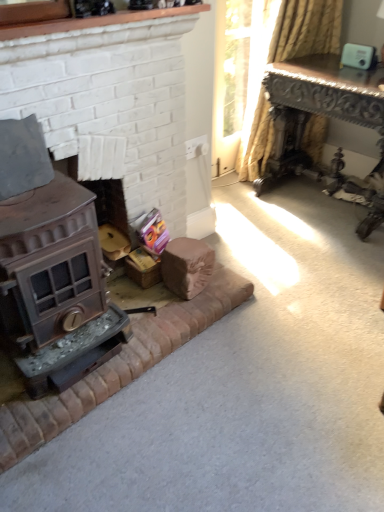
Identify the location of bronze metallic fireplace at lower left, marked as the second fireplace in a top-to-bottom arrangement. (113, 101).

What do you see at coordinates (306, 29) in the screenshot? The height and width of the screenshot is (512, 384). I see `yellow striped fabric at upper right` at bounding box center [306, 29].

Identify the location of matte brown wood stove at left, which is the 1th fireplace in top-to-bottom order. Image resolution: width=384 pixels, height=512 pixels. (109, 100).

I want to click on fireplace located above the bronze metallic fireplace at lower left, arranged as the 1th fireplace when ordered from the bottom (from a real-world perspective), so click(109, 100).

Is bronze metallic fireplace at lower left, arranged as the 1th fireplace when ordered from the bottom, next to matte brown wood stove at left, placed as the second fireplace when sorted from bottom to top?

Absolutely, bronze metallic fireplace at lower left, arranged as the 1th fireplace when ordered from the bottom, is next to and touching matte brown wood stove at left, placed as the second fireplace when sorted from bottom to top.

Does bronze metallic fireplace at lower left, marked as the second fireplace in a top-to-bottom arrangement, have a smaller size compared to matte brown wood stove at left, placed as the second fireplace when sorted from bottom to top?

Incorrect, bronze metallic fireplace at lower left, marked as the second fireplace in a top-to-bottom arrangement, is not smaller in size than matte brown wood stove at left, placed as the second fireplace when sorted from bottom to top.

Choose the correct answer: Is bronze metallic fireplace at lower left, marked as the second fireplace in a top-to-bottom arrangement, inside matte brown wood stove at left, placed as the second fireplace when sorted from bottom to top, or outside it?

bronze metallic fireplace at lower left, marked as the second fireplace in a top-to-bottom arrangement, is outside matte brown wood stove at left, placed as the second fireplace when sorted from bottom to top.

Based on the photo, measure the distance from bronze metallic wood burning stove at lower left to matte brown wood stove at left, placed as the second fireplace when sorted from bottom to top.

bronze metallic wood burning stove at lower left is 17.22 inches from matte brown wood stove at left, placed as the second fireplace when sorted from bottom to top.

Which is behind, bronze metallic wood burning stove at lower left or matte brown wood stove at left, placed as the second fireplace when sorted from bottom to top?

matte brown wood stove at left, placed as the second fireplace when sorted from bottom to top.

Considering the positions of points (24, 290) and (138, 79), is point (24, 290) closer to camera compared to point (138, 79)?

Yes, it is.

Is bronze metallic wood burning stove at lower left facing towards matte brown wood stove at left, which is the 1th fireplace in top-to-bottom order?

No, bronze metallic wood burning stove at lower left is not oriented towards matte brown wood stove at left, which is the 1th fireplace in top-to-bottom order.

Would you say matte brown wood stove at left, placed as the second fireplace when sorted from bottom to top, is inside or outside dark brown polished wood table at upper right?

matte brown wood stove at left, placed as the second fireplace when sorted from bottom to top, exists outside the volume of dark brown polished wood table at upper right.

From the image's perspective, which one is positioned higher, matte brown wood stove at left, placed as the second fireplace when sorted from bottom to top, or dark brown polished wood table at upper right?

dark brown polished wood table at upper right appears higher in the image.

Considering the positions of objects matte brown wood stove at left, which is the 1th fireplace in top-to-bottom order, and dark brown polished wood table at upper right in the image provided, who is behind, matte brown wood stove at left, which is the 1th fireplace in top-to-bottom order, or dark brown polished wood table at upper right?

dark brown polished wood table at upper right is more distant.

Which of these two, matte brown wood stove at left, which is the 1th fireplace in top-to-bottom order, or dark brown polished wood table at upper right, is smaller?

matte brown wood stove at left, which is the 1th fireplace in top-to-bottom order.

From a real-world perspective, is bronze metallic wood burning stove at lower left above or below yellow striped fabric at upper right?

bronze metallic wood burning stove at lower left is below yellow striped fabric at upper right.

Which of these two, bronze metallic wood burning stove at lower left or yellow striped fabric at upper right, is wider?

bronze metallic wood burning stove at lower left is wider.

Can we say bronze metallic wood burning stove at lower left lies outside yellow striped fabric at upper right?

bronze metallic wood burning stove at lower left is positioned outside yellow striped fabric at upper right.

From a real-world perspective, between bronze metallic fireplace at lower left, marked as the second fireplace in a top-to-bottom arrangement, and yellow striped fabric at upper right, who is vertically lower?

In real-world perspective, bronze metallic fireplace at lower left, marked as the second fireplace in a top-to-bottom arrangement, is lower.

Is the surface of bronze metallic fireplace at lower left, marked as the second fireplace in a top-to-bottom arrangement, in direct contact with yellow striped fabric at upper right?

bronze metallic fireplace at lower left, marked as the second fireplace in a top-to-bottom arrangement, is not next to yellow striped fabric at upper right, and they're not touching.

Is bronze metallic fireplace at lower left, arranged as the 1th fireplace when ordered from the bottom, closer to the viewer compared to yellow striped fabric at upper right?

Yes.

Is bronze metallic fireplace at lower left, arranged as the 1th fireplace when ordered from the bottom, not inside yellow striped fabric at upper right?

bronze metallic fireplace at lower left, arranged as the 1th fireplace when ordered from the bottom, is positioned outside yellow striped fabric at upper right.

Can yellow striped fabric at upper right be found inside matte brown wood stove at left, which is the 1th fireplace in top-to-bottom order?

No, yellow striped fabric at upper right is not a part of matte brown wood stove at left, which is the 1th fireplace in top-to-bottom order.

Between matte brown wood stove at left, placed as the second fireplace when sorted from bottom to top, and yellow striped fabric at upper right, which one has less height?

matte brown wood stove at left, placed as the second fireplace when sorted from bottom to top, is shorter.

Considering the relative sizes of matte brown wood stove at left, placed as the second fireplace when sorted from bottom to top, and yellow striped fabric at upper right in the image provided, is matte brown wood stove at left, placed as the second fireplace when sorted from bottom to top, thinner than yellow striped fabric at upper right?

Indeed, matte brown wood stove at left, placed as the second fireplace when sorted from bottom to top, has a lesser width compared to yellow striped fabric at upper right.

Image resolution: width=384 pixels, height=512 pixels. I want to click on curtain that is on the right side of matte brown wood stove at left, placed as the second fireplace when sorted from bottom to top, so click(x=306, y=29).

From the image's perspective, which one is positioned lower, yellow striped fabric at upper right or matte brown wood stove at left, which is the 1th fireplace in top-to-bottom order?

From the image's view, matte brown wood stove at left, which is the 1th fireplace in top-to-bottom order, is below.

Considering the sizes of objects yellow striped fabric at upper right and matte brown wood stove at left, which is the 1th fireplace in top-to-bottom order, in the image provided, who is shorter, yellow striped fabric at upper right or matte brown wood stove at left, which is the 1th fireplace in top-to-bottom order,?

matte brown wood stove at left, which is the 1th fireplace in top-to-bottom order.

Is yellow striped fabric at upper right positioned far away from matte brown wood stove at left, which is the 1th fireplace in top-to-bottom order?

Indeed, yellow striped fabric at upper right is not near matte brown wood stove at left, which is the 1th fireplace in top-to-bottom order.

At what (x,y) coordinates should I click in order to perform the action: click on fireplace above the bronze metallic fireplace at lower left, marked as the second fireplace in a top-to-bottom arrangement (from the image's perspective). Please return your answer as a coordinate pair (x, y). The image size is (384, 512). Looking at the image, I should click on (109, 100).

Identify the location of wood burning stove that appears on the left of matte brown wood stove at left, placed as the second fireplace when sorted from bottom to top. This screenshot has width=384, height=512. (53, 281).

Estimate the real-world distances between objects in this image. Which object is further from matte brown wood stove at left, which is the 1th fireplace in top-to-bottom order, bronze metallic fireplace at lower left, arranged as the 1th fireplace when ordered from the bottom, or yellow striped fabric at upper right?

The object further to matte brown wood stove at left, which is the 1th fireplace in top-to-bottom order, is yellow striped fabric at upper right.

Considering their positions, is bronze metallic fireplace at lower left, marked as the second fireplace in a top-to-bottom arrangement, positioned closer to yellow striped fabric at upper right than bronze metallic wood burning stove at lower left?

The object closer to yellow striped fabric at upper right is bronze metallic fireplace at lower left, marked as the second fireplace in a top-to-bottom arrangement.

Estimate the real-world distances between objects in this image. Which object is closer to bronze metallic fireplace at lower left, arranged as the 1th fireplace when ordered from the bottom, bronze metallic wood burning stove at lower left or matte brown wood stove at left, which is the 1th fireplace in top-to-bottom order?

matte brown wood stove at left, which is the 1th fireplace in top-to-bottom order.

Based on their spatial positions, is yellow striped fabric at upper right or matte brown wood stove at left, placed as the second fireplace when sorted from bottom to top, further from bronze metallic wood burning stove at lower left?

The object further to bronze metallic wood burning stove at lower left is yellow striped fabric at upper right.

Based on their spatial positions, is dark brown polished wood table at upper right or yellow striped fabric at upper right further from matte brown wood stove at left, placed as the second fireplace when sorted from bottom to top?

yellow striped fabric at upper right is positioned further to the anchor matte brown wood stove at left, placed as the second fireplace when sorted from bottom to top.

Considering their positions, is matte brown wood stove at left, placed as the second fireplace when sorted from bottom to top, positioned closer to bronze metallic wood burning stove at lower left than bronze metallic fireplace at lower left, marked as the second fireplace in a top-to-bottom arrangement?

matte brown wood stove at left, placed as the second fireplace when sorted from bottom to top.

When comparing their distances from dark brown polished wood table at upper right, does yellow striped fabric at upper right or matte brown wood stove at left, placed as the second fireplace when sorted from bottom to top, seem closer?

Answer: The object closer to dark brown polished wood table at upper right is yellow striped fabric at upper right.

Based on their spatial positions, is dark brown polished wood table at upper right or yellow striped fabric at upper right closer to bronze metallic wood burning stove at lower left?

Among the two, dark brown polished wood table at upper right is located nearer to bronze metallic wood burning stove at lower left.

Identify the location of wood burning stove between matte brown wood stove at left, placed as the second fireplace when sorted from bottom to top, and bronze metallic fireplace at lower left, arranged as the 1th fireplace when ordered from the bottom, in the up-down direction. 53,281.

This screenshot has width=384, height=512. What are the coordinates of `curtain between bronze metallic wood burning stove at lower left and dark brown polished wood table at upper right in the horizontal direction` in the screenshot? It's located at (306, 29).

This screenshot has width=384, height=512. Find the location of `fireplace located between bronze metallic fireplace at lower left, arranged as the 1th fireplace when ordered from the bottom, and dark brown polished wood table at upper right in the left-right direction`. fireplace located between bronze metallic fireplace at lower left, arranged as the 1th fireplace when ordered from the bottom, and dark brown polished wood table at upper right in the left-right direction is located at coordinates (109, 100).

This screenshot has height=512, width=384. What are the coordinates of `curtain between matte brown wood stove at left, placed as the second fireplace when sorted from bottom to top, and dark brown polished wood table at upper right from left to right` in the screenshot? It's located at (306, 29).